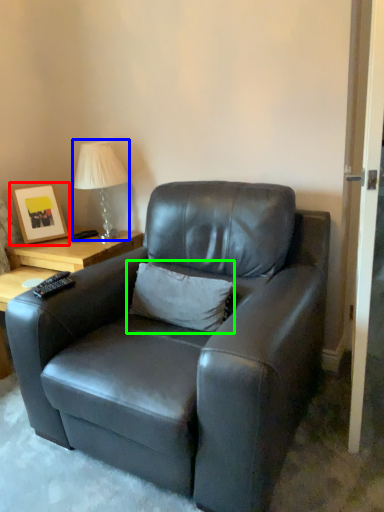
Question: Which is farther away from picture frame (highlighted by a red box)? table lamp (highlighted by a blue box) or pillow (highlighted by a green box)?

Choices:
 (A) table lamp
 (B) pillow

Answer: (B)